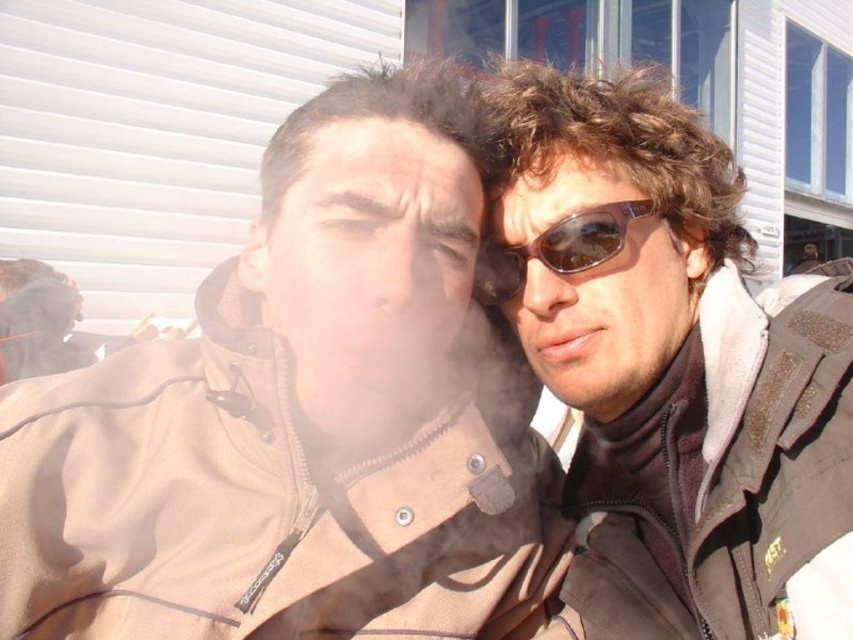
You are standing at the point marked as point (299, 420) in the image. What object is exactly at this location?

The brown soft jacket at center is exactly at point (299, 420).

You are standing in the scene and want to know how far the point at coordinates (647, 90) is from you. Can you determine the distance?

The point at coordinates (647, 90) is 6.03 feet from the viewer.

You are a fashion designer observing the two individuals in the image. You need to determine which item, the brown soft jacket at center or the sunglasses at right, would require less fabric to produce. Based on their sizes, which one would need less material?

The brown soft jacket at center has a smaller size compared to sunglasses at right, so it would require less fabric to produce.